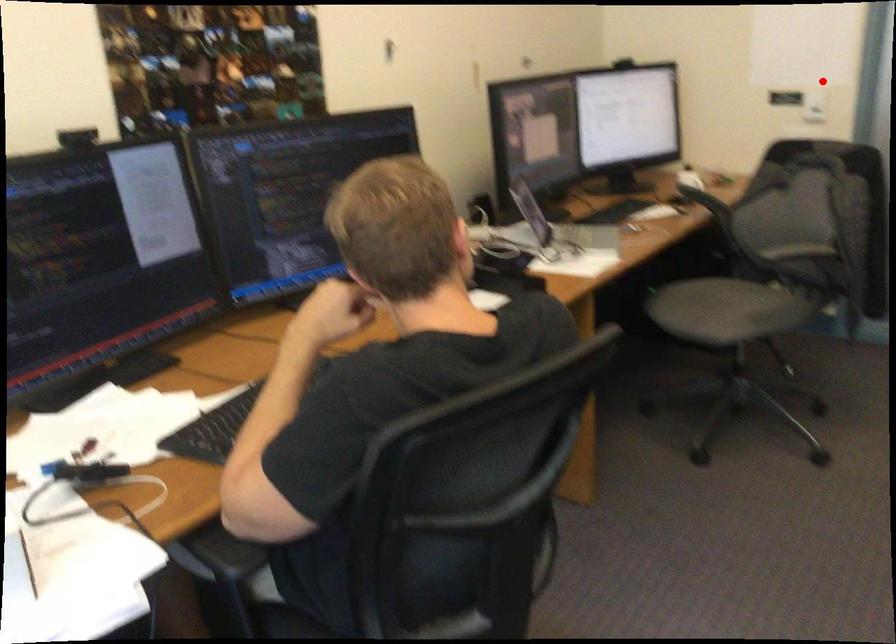
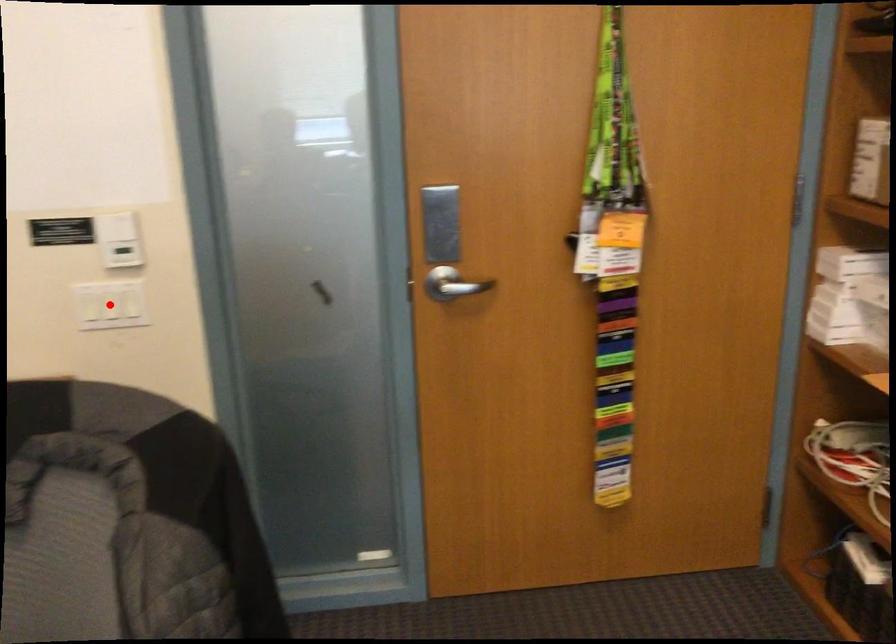
I am providing you with two images of the same scene from different viewpoints. A red point is marked on the first image and another point is marked on the second image. Are the points marked in image1 and image2 representing the same 3D position?

No